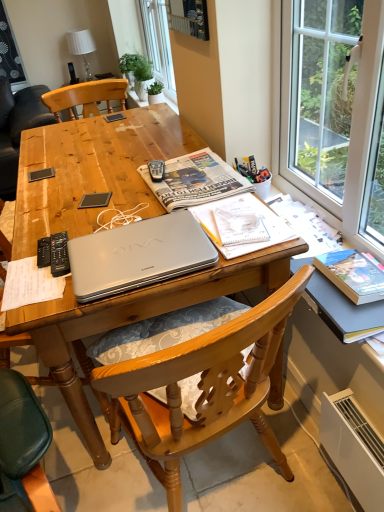
Where is `free point above wooden table at center (from a real-world perspective)`? Image resolution: width=384 pixels, height=512 pixels. free point above wooden table at center (from a real-world perspective) is located at coordinates (96, 177).